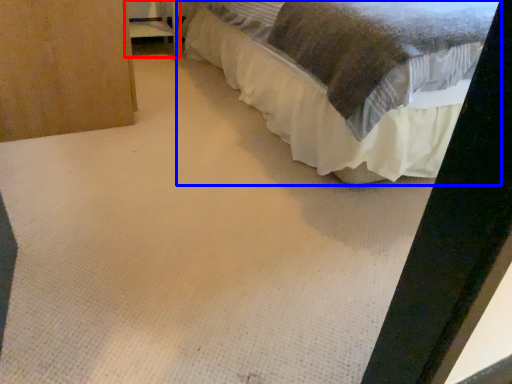
Question: Among these objects, which one is farthest to the camera, furniture (highlighted by a red box) or bed (highlighted by a blue box)?

Choices:
 (A) furniture
 (B) bed

Answer: (A)